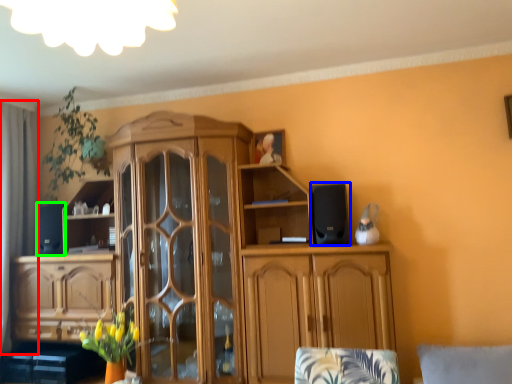
Question: Which object is the farthest from curtain (highlighted by a red box)? Choose among these: speaker (highlighted by a blue box) or speaker (highlighted by a green box).

Choices:
 (A) speaker
 (B) speaker

Answer: (A)